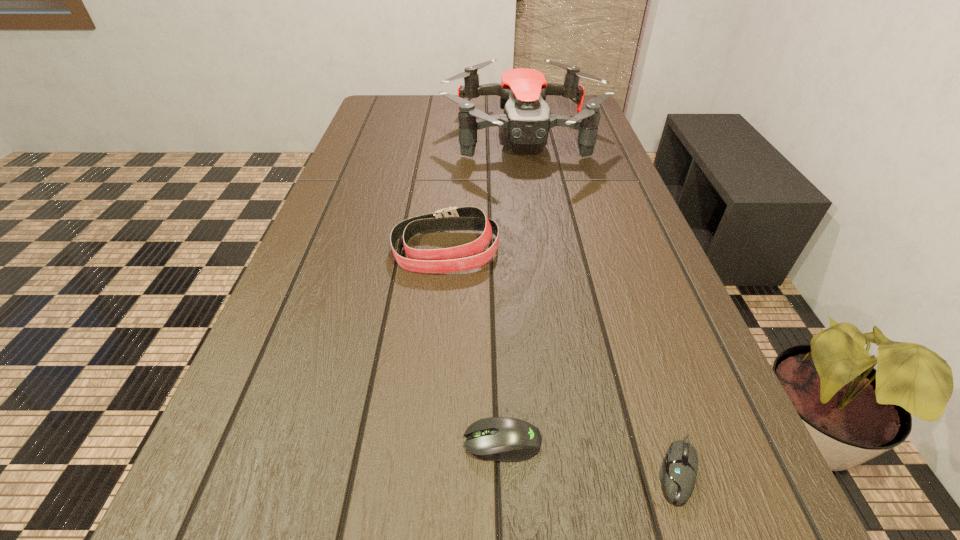
The width and height of the screenshot is (960, 540). Identify the location of the farthest object. (526, 120).

Identify the location of the tallest object. This screenshot has width=960, height=540. (526, 120).

Image resolution: width=960 pixels, height=540 pixels. What are the coordinates of `the third nearest object` in the screenshot? It's located at (466, 257).

Identify the location of dog collar. The width and height of the screenshot is (960, 540). (466, 257).

Where is `the second shortest object`? The height and width of the screenshot is (540, 960). the second shortest object is located at coordinates (505, 439).

I want to click on the taller computer mouse, so click(x=505, y=439).

The image size is (960, 540). In order to click on the shorter computer mouse in this screenshot , I will do `click(678, 472)`.

What are the coordinates of `the right computer mouse` in the screenshot? It's located at (678, 472).

The image size is (960, 540). I want to click on free location located on the camera side of the tallest object, so click(x=538, y=227).

Image resolution: width=960 pixels, height=540 pixels. I want to click on vacant area situated on the left of the third shortest object, so click(355, 250).